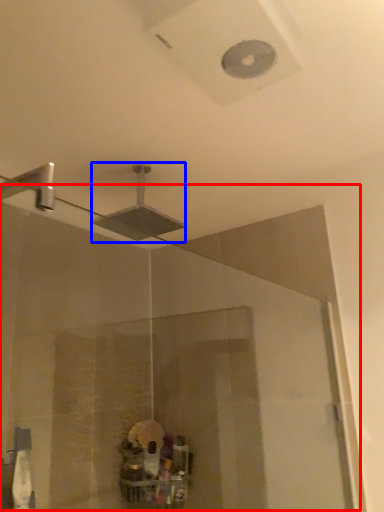
Question: Which object appears farthest to the camera in this image, glass door (highlighted by a red box) or shower (highlighted by a blue box)?

Choices:
 (A) glass door
 (B) shower

Answer: (B)